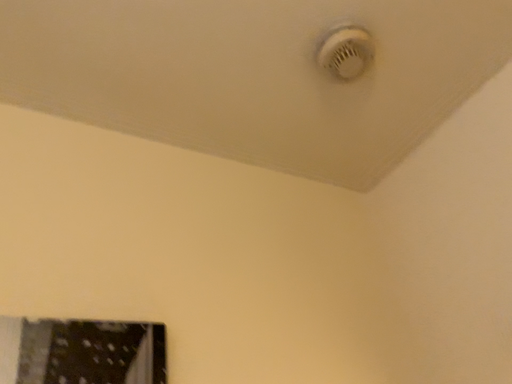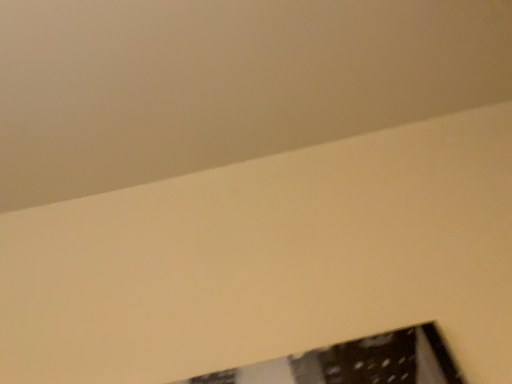
Question: Which way did the camera rotate in the video?

Choices:
 (A) rotated right
 (B) rotated left

Answer: (B)